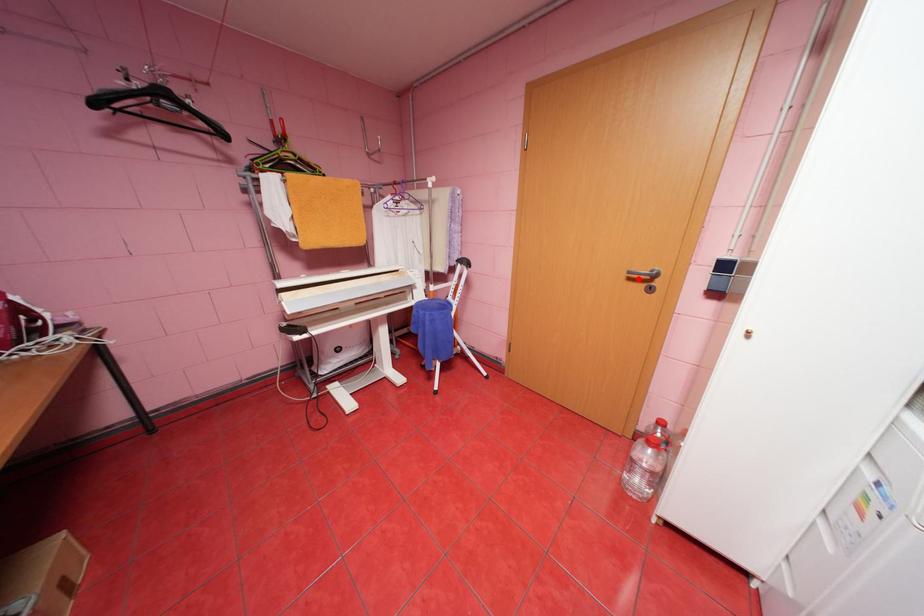
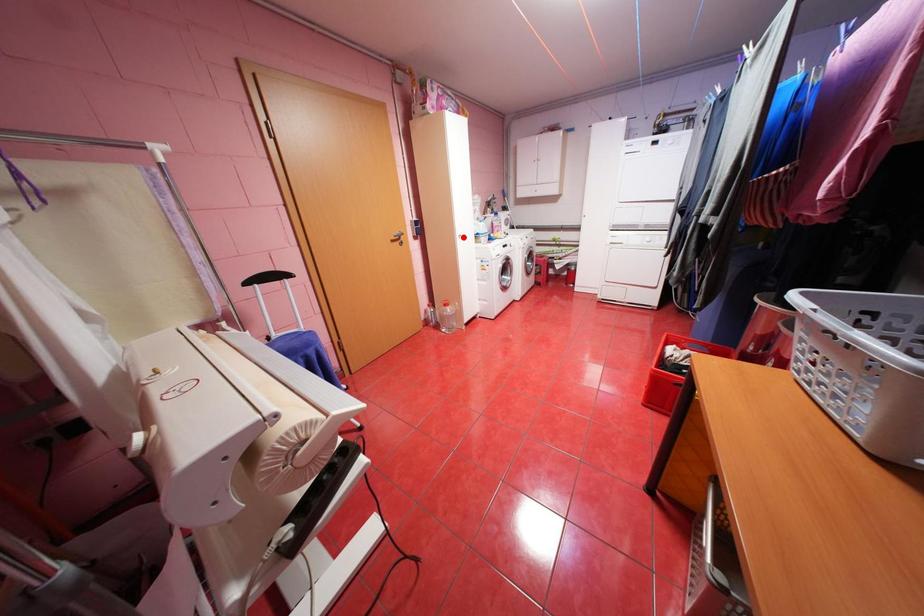
I am providing you with two images of the same scene from different viewpoints. A red point is marked on the first image and another point is marked on the second image. Do the highlighted points in image1 and image2 indicate the same real-world spot?

No